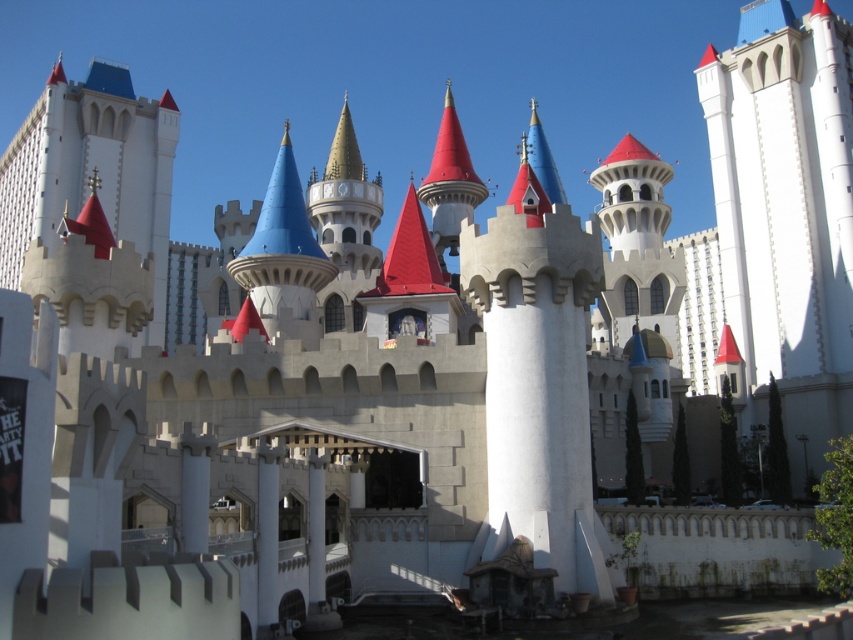
Question: Does white stone tower at upper right have a greater width compared to white stone castle at upper left?

Choices:
 (A) no
 (B) yes

Answer: (A)

Question: Is white stone tower at upper right to the left of white stone castle at upper left from the viewer's perspective?

Choices:
 (A) yes
 (B) no

Answer: (B)

Question: Can you confirm if white stone tower at upper right is wider than white stone castle at upper left?

Choices:
 (A) yes
 (B) no

Answer: (B)

Question: Which point is closer to the camera taking this photo?

Choices:
 (A) (39, 116)
 (B) (717, 188)

Answer: (B)